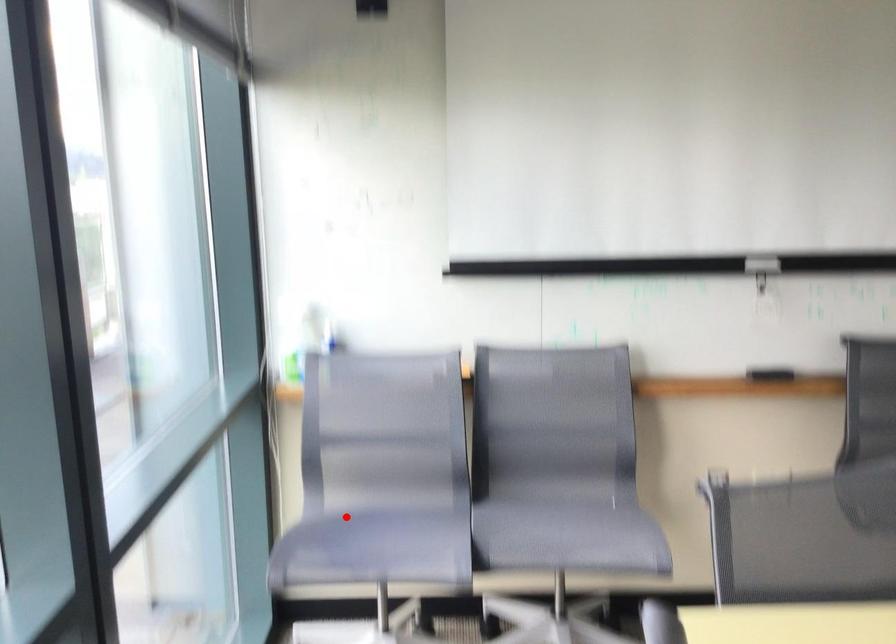
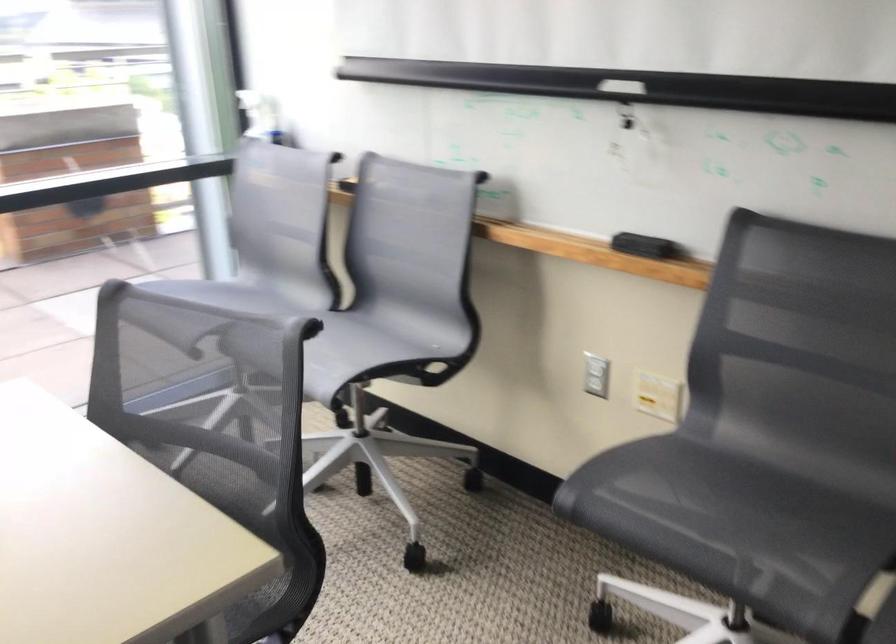
Find the pixel in the second image that matches the highlighted location in the first image.

(218, 290)